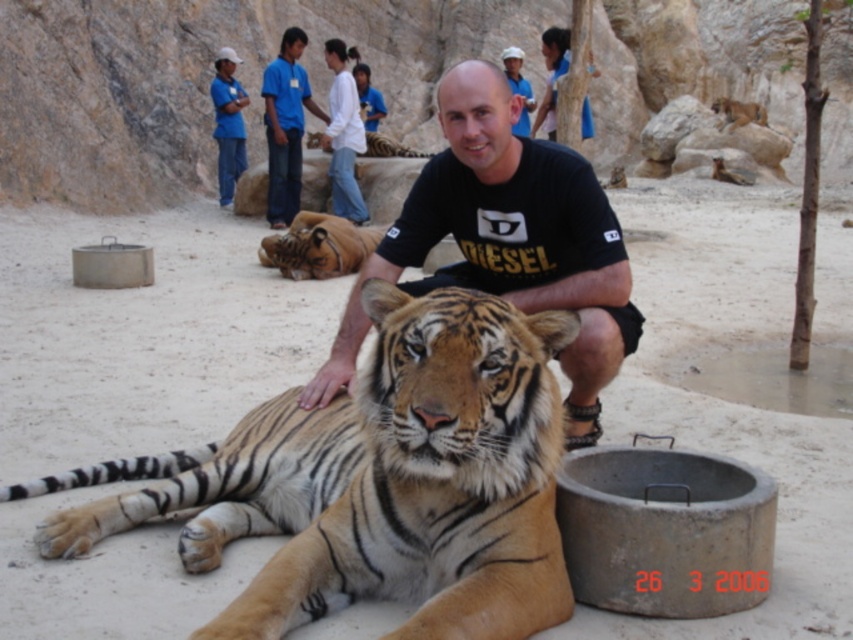
You are a photographer positioned at the edge of the sanctuary. You need to capture a photo that includes both the blue cotton shirt at upper center and the golden fur tiger at center. Based on their sizes, which object should you focus on first to ensure both are in frame?

The blue cotton shirt at upper center is larger in size compared to the golden fur tiger at center. To ensure both are in frame, focus on the blue cotton shirt at upper center first as it requires more space in the composition.